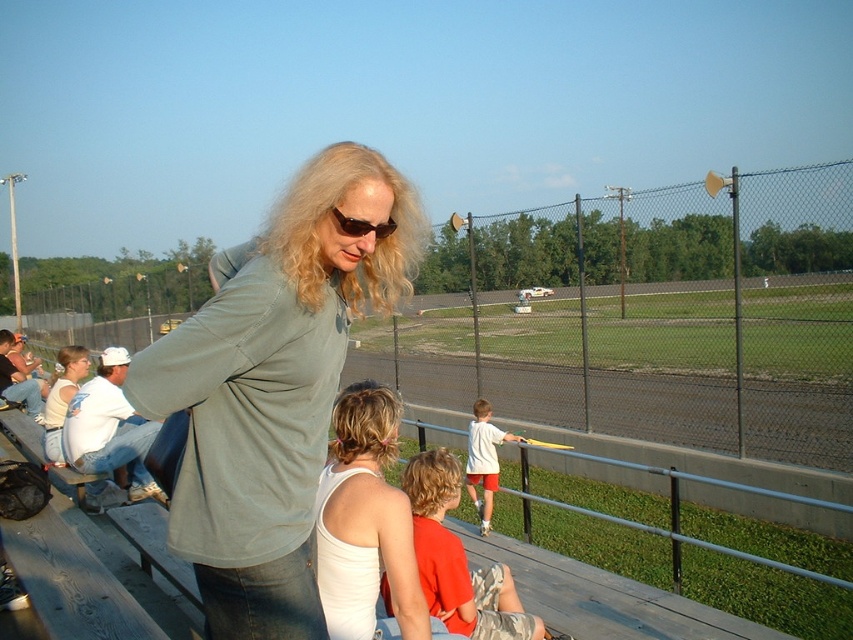
Can you confirm if white matte shirt at center is taller than matte black sunglasses at center?

Indeed, white matte shirt at center has a greater height compared to matte black sunglasses at center.

Between white matte shirt at center and matte black sunglasses at center, which one appears on the right side from the viewer's perspective?

white matte shirt at center

Is point (474, 470) behind point (357, 227)?

Yes, point (474, 470) is behind point (357, 227).

Identify the location of white matte shirt at center. (485, 460).

Between point (310, 380) and point (469, 605), which one is positioned behind?

The point (469, 605) is more distant.

Who is more distant from viewer, (331,376) or (467,620)?

Positioned behind is point (467,620).

You are a GUI agent. You are given a task and a screenshot of the screen. Output one action in this format:
    pyautogui.click(x=<x>, y=<y>)
    Task: Click on the matte green shirt at center
    This screenshot has height=640, width=853.
    Given the screenshot: What is the action you would take?
    pyautogui.click(x=273, y=387)

This screenshot has height=640, width=853. What do you see at coordinates (364, 522) in the screenshot?
I see `white tank top at center` at bounding box center [364, 522].

Between point (315, 532) and point (421, 582), which one is positioned in front?

Positioned in front is point (315, 532).

Find the location of `white tank top at center`. white tank top at center is located at coordinates (364, 522).